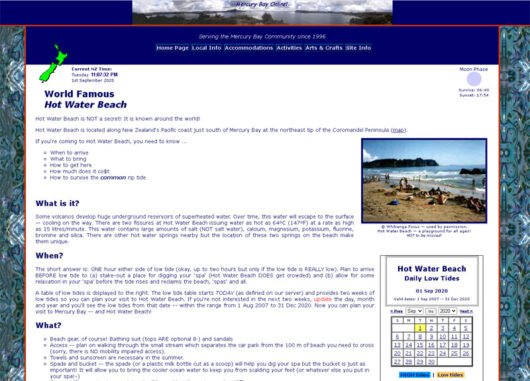
Locate an element on the screen. The width and height of the screenshot is (530, 381). calendar is located at coordinates (446, 348).